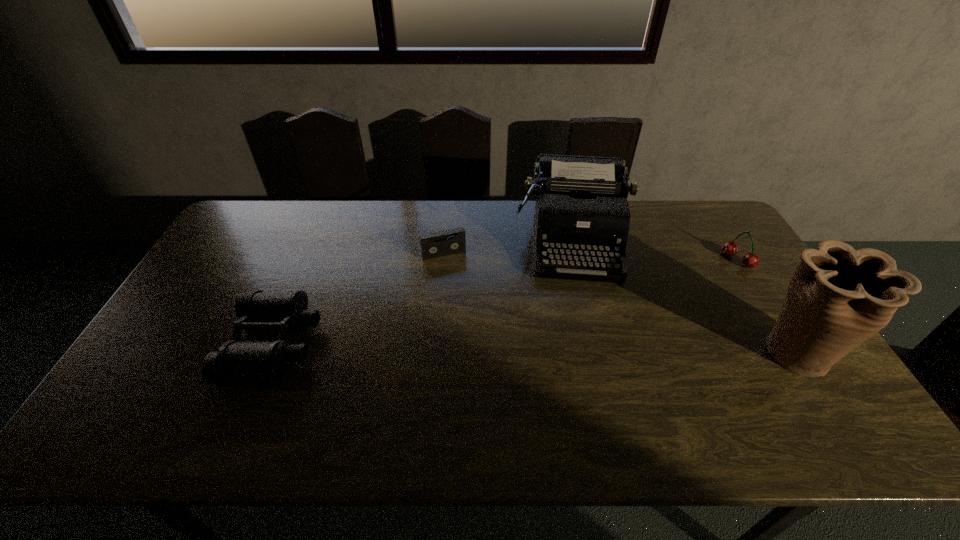
Image resolution: width=960 pixels, height=540 pixels. Identify the location of unoccupied area between the typewriter and the leftmost object. (423, 293).

Locate an element on the screen. This screenshot has width=960, height=540. vacant space that's between the binoculars and the tallest object is located at coordinates (535, 349).

Find the location of `free spot between the second object from left to right and the binoculars`. free spot between the second object from left to right and the binoculars is located at coordinates (359, 300).

Find the location of `vacant area that lies between the second object from left to right and the fourth shortest object`. vacant area that lies between the second object from left to right and the fourth shortest object is located at coordinates (508, 247).

The image size is (960, 540). In order to click on free spot between the leftmost object and the videotape in this screenshot , I will do `click(359, 300)`.

The height and width of the screenshot is (540, 960). What are the coordinates of `free space between the third object from right to left and the tallest object` in the screenshot? It's located at (684, 296).

Where is `object that can be found as the fourth closest to the binoculars`? The width and height of the screenshot is (960, 540). object that can be found as the fourth closest to the binoculars is located at coordinates (750, 260).

Identify which object is located as the nearest to the third object from left to right. Please provide its 2D coordinates. Your answer should be formatted as a tuple, i.e. [(x, y)], where the tuple contains the x and y coordinates of a point satisfying the conditions above.

[(435, 244)]

Locate an element on the screen. free location that satisfies the following two spatial constraints: 1. on the front side of the cherry; 2. on the left side of the tallest object is located at coordinates (795, 353).

Locate an element on the screen. free region that satisfies the following two spatial constraints: 1. on the front side of the cherry; 2. on the left side of the videotape is located at coordinates tap(444, 260).